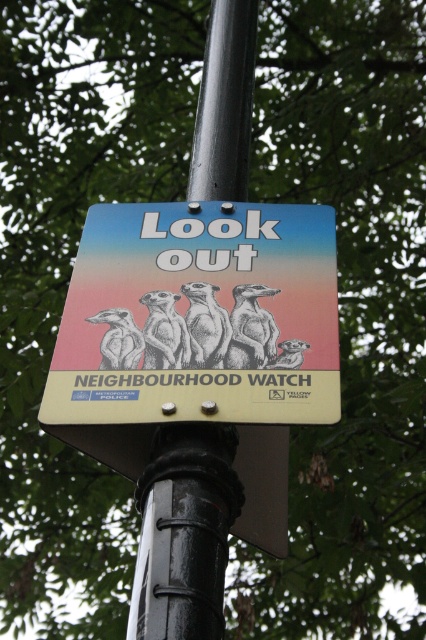
Question: Does matte plastic sign at center have a greater width compared to black metal pole at center?

Choices:
 (A) no
 (B) yes

Answer: (B)

Question: Among these objects, which one is farthest from the camera?

Choices:
 (A) black metal pole at center
 (B) matte plastic sign at center

Answer: (A)

Question: Which point is farther to the camera?

Choices:
 (A) black metal pole at center
 (B) matte plastic sign at center

Answer: (A)

Question: Can you confirm if matte plastic sign at center is positioned below black metal pole at center?

Choices:
 (A) no
 (B) yes

Answer: (B)

Question: Can you confirm if matte plastic sign at center is positioned above black metal pole at center?

Choices:
 (A) yes
 (B) no

Answer: (B)